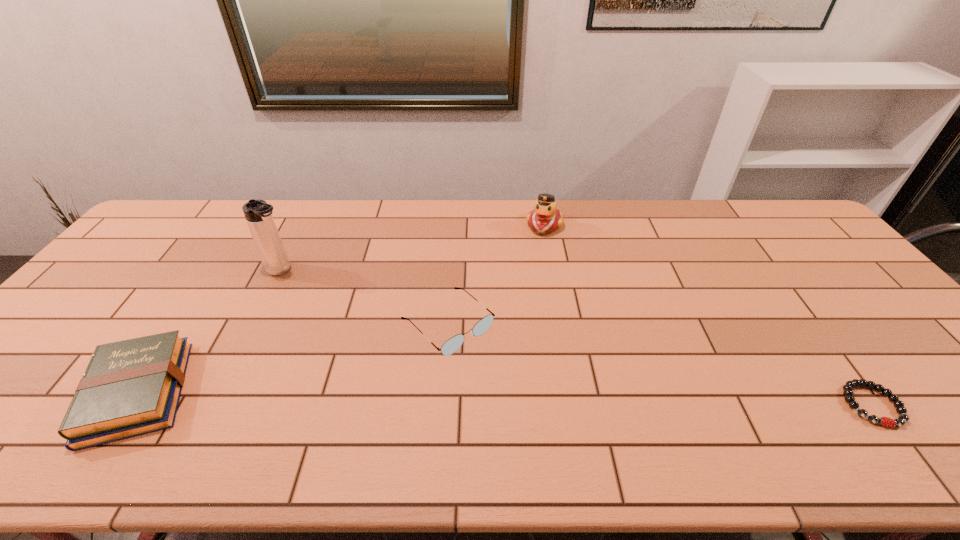
What are the coordinates of `free space on the desktop that is between the book and the rightmost object and is positioned on the face of the duck` in the screenshot? It's located at (495, 399).

Find the location of `vacant space on the desktop that is between the book and the bracelet and is positioned on the handle side of the thermos bottle`. vacant space on the desktop that is between the book and the bracelet and is positioned on the handle side of the thermos bottle is located at coordinates (494, 399).

At what (x,y) coordinates should I click in order to perform the action: click on free space on the desktop that is between the book and the bracelet and is positioned on the lenses of the third object from left to right. Please return your answer as a coordinate pair (x, y). The image size is (960, 540). Looking at the image, I should click on (528, 399).